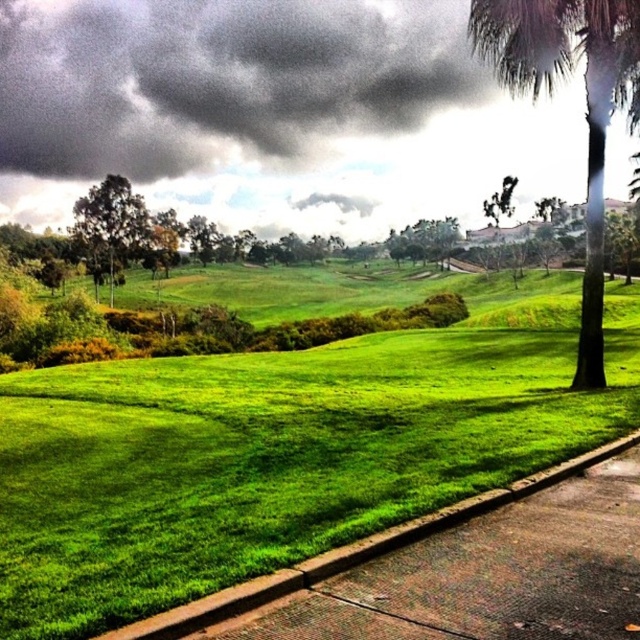
Question: Is green leafy tree at left smaller than green leafy tree at upper right?

Choices:
 (A) yes
 (B) no

Answer: (A)

Question: Which object appears closest to the camera in this image?

Choices:
 (A) green leafy tree at upper right
 (B) green leafy palm tree at center-right

Answer: (B)

Question: In this image, where is green leafy palm tree at center-right located relative to green leafy tree at left?

Choices:
 (A) above
 (B) below

Answer: (A)

Question: Among these points, which one is nearest to the camera?

Choices:
 (A) (x=129, y=204)
 (B) (x=566, y=48)

Answer: (B)

Question: Among these objects, which one is farthest from the camera?

Choices:
 (A) green leafy tree at upper right
 (B) green leafy palm tree at center-right

Answer: (A)

Question: Does green leafy tree at left appear on the left side of green leafy tree at upper right?

Choices:
 (A) yes
 (B) no

Answer: (A)